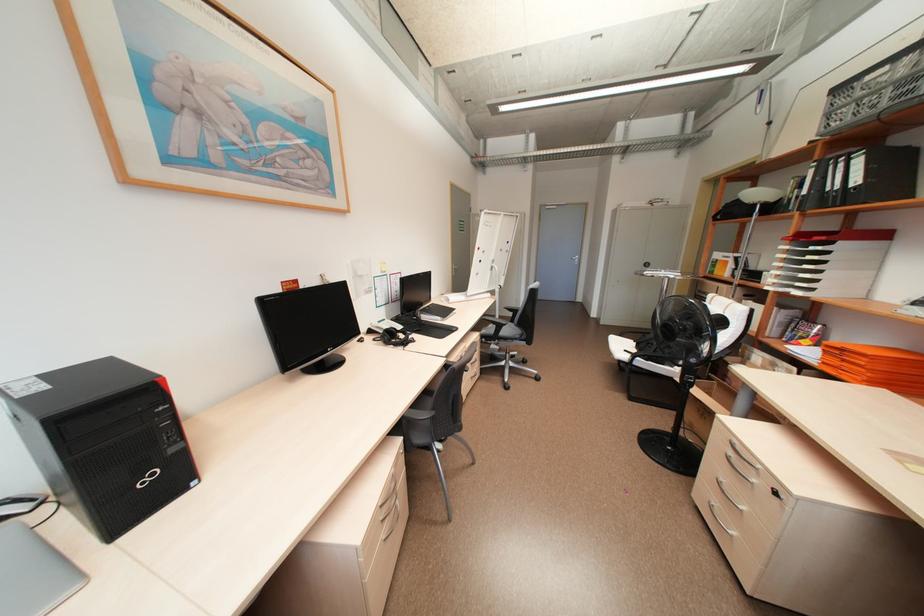
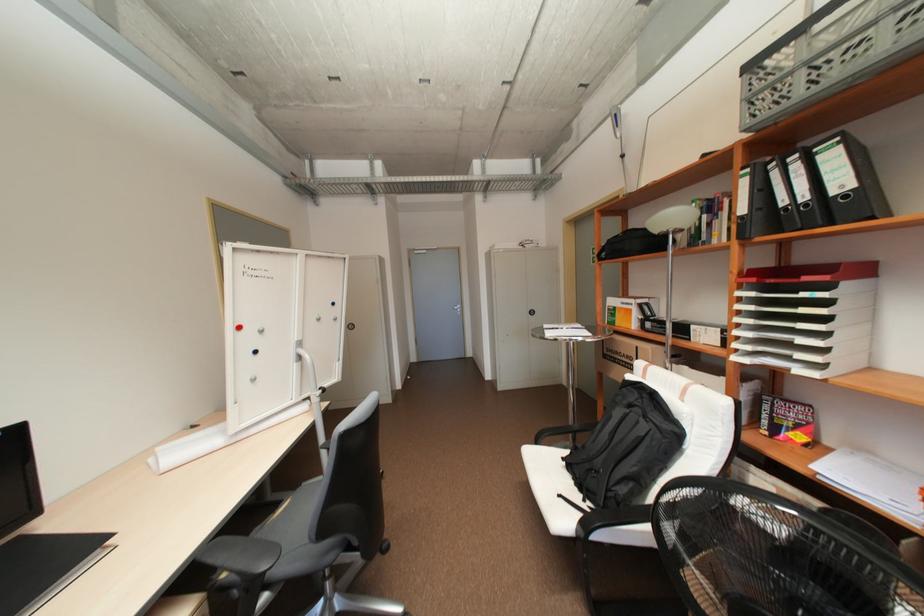
The images are taken continuously from a first-person perspective. In which direction are you moving?

The cameraman walked toward right, forward.